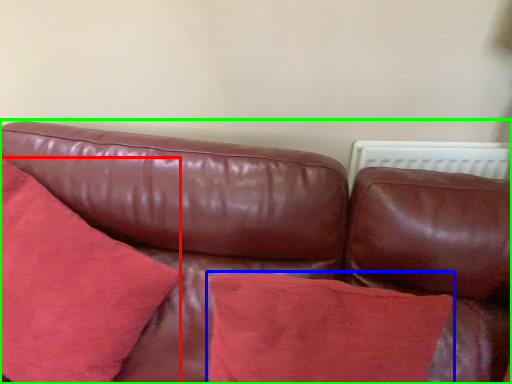
Question: Based on their relative distances, which object is nearer to throw pillow (highlighted by a red box)? Choose from throw pillow (highlighted by a blue box) and studio couch (highlighted by a green box).

Choices:
 (A) throw pillow
 (B) studio couch

Answer: (B)